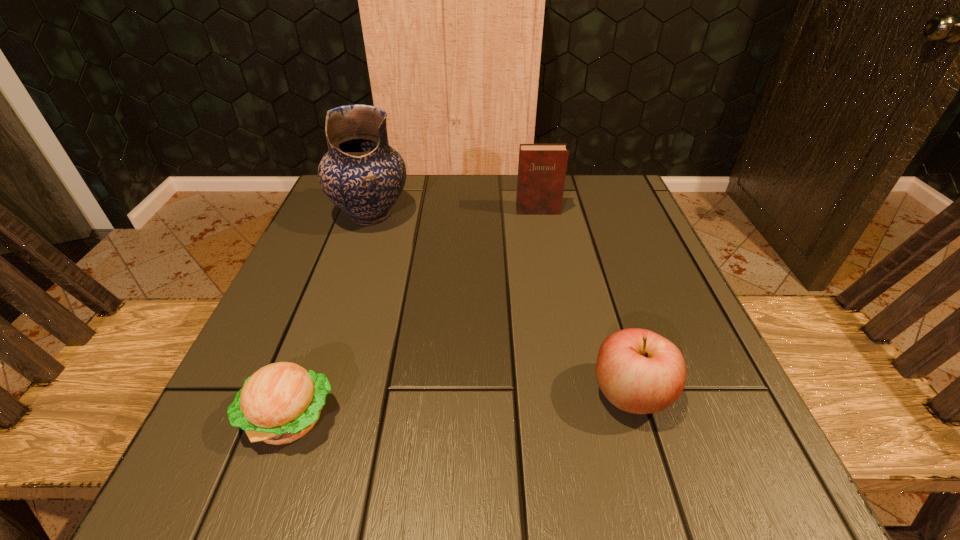
Where is `object that is at the near edge`? This screenshot has width=960, height=540. object that is at the near edge is located at coordinates (281, 402).

What are the coordinates of `pottery that is at the left edge` in the screenshot? It's located at (361, 174).

What are the coordinates of `hamburger that is at the left edge` in the screenshot? It's located at (281, 402).

Where is `object located in the right edge section of the desktop`? The image size is (960, 540). object located in the right edge section of the desktop is located at coordinates (639, 371).

Image resolution: width=960 pixels, height=540 pixels. In order to click on object that is at the far left corner in this screenshot , I will do `click(361, 174)`.

Image resolution: width=960 pixels, height=540 pixels. Identify the location of object at the near left corner. (281, 402).

Find the location of `vacant space at the far edge of the desktop`. vacant space at the far edge of the desktop is located at coordinates (397, 224).

Image resolution: width=960 pixels, height=540 pixels. Identify the location of free space at the near edge. (404, 467).

The image size is (960, 540). Identify the location of vacant space at the left edge of the desktop. [204, 436].

Where is `vacant space at the right edge`? The height and width of the screenshot is (540, 960). vacant space at the right edge is located at coordinates (616, 228).